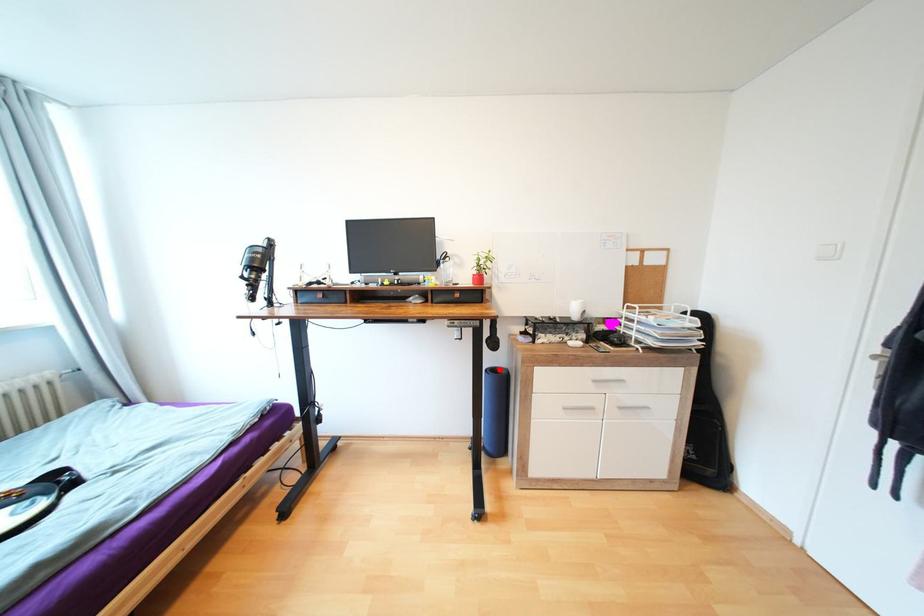
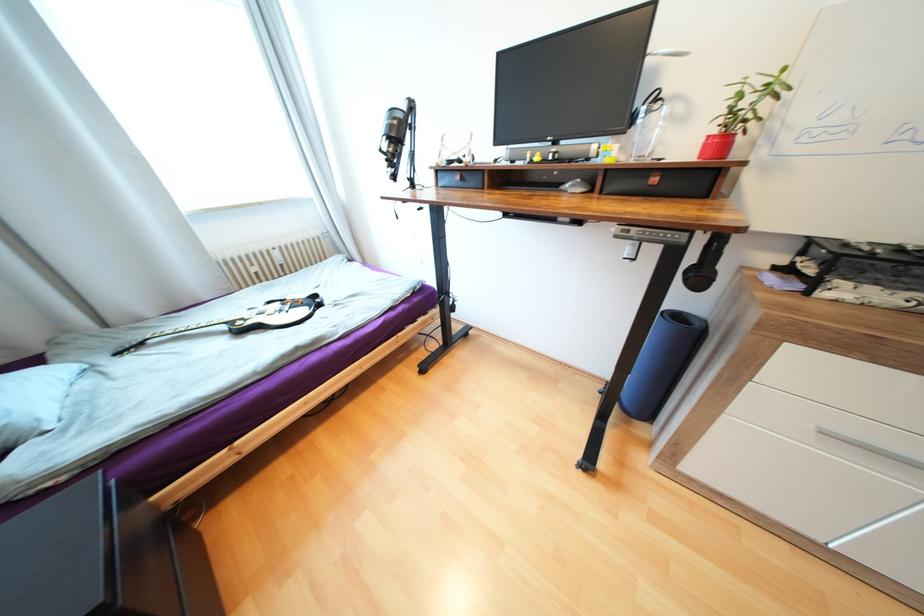
Question: A red point is marked in image1. In image2, is the corresponding 3D point closer to the camera or farther? Reply with the corresponding letter.

Choices:
 (A) The corresponding 3D point is closer.
 (B) The corresponding 3D point is farther.

Answer: (A)